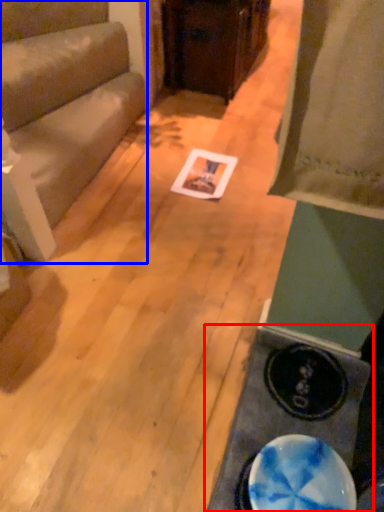
Question: Which object is closer to the camera taking this photo, table (highlighted by a red box) or furniture (highlighted by a blue box)?

Choices:
 (A) table
 (B) furniture

Answer: (A)